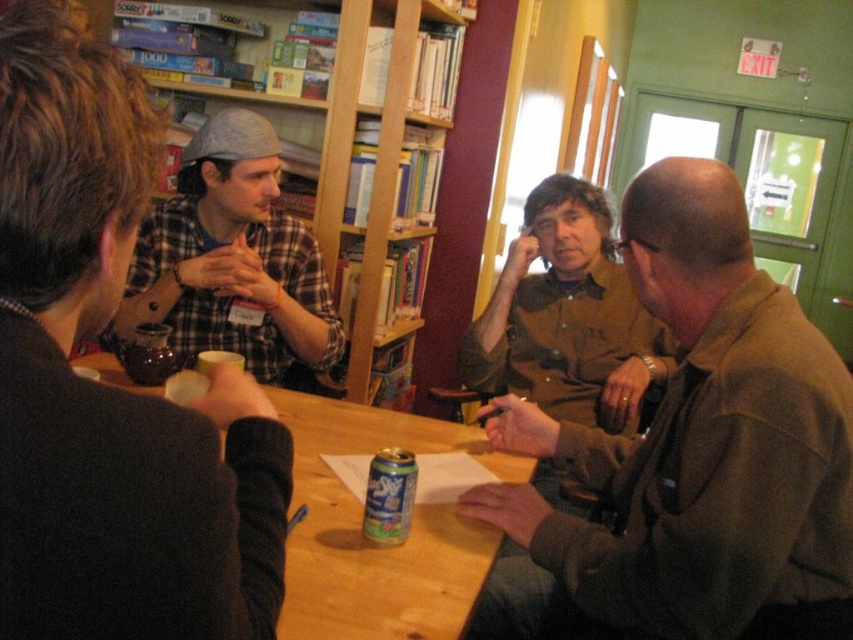
Is wooden table at center bigger than brown matte shirt at center?

Incorrect, wooden table at center is not larger than brown matte shirt at center.

Is wooden table at center positioned before brown matte shirt at center?

That is True.

Between point (375, 410) and point (531, 339), which one is positioned behind?

The point (531, 339) is behind.

Locate an element on the screen. The width and height of the screenshot is (853, 640). wooden table at center is located at coordinates (368, 541).

Between wooden bookshelf at upper center and wooden table at center, which one is positioned higher?

wooden bookshelf at upper center

Who is positioned more to the left, wooden bookshelf at upper center or wooden table at center?

wooden bookshelf at upper center is more to the left.

Is point (166, 280) closer to viewer compared to point (457, 548)?

No, (166, 280) is behind (457, 548).

Identify the location of wooden bookshelf at upper center. (308, 228).

Is plaid fabric shirt at upper left further to the viewer compared to brown matte shirt at center?

Yes.

Between point (196, 230) and point (585, 408), which one is positioned in front?

Point (196, 230) is more forward.

Between point (126, 316) and point (572, 180), which one is positioned behind?

Point (572, 180)

This screenshot has height=640, width=853. I want to click on plaid fabric shirt at upper left, so click(231, 259).